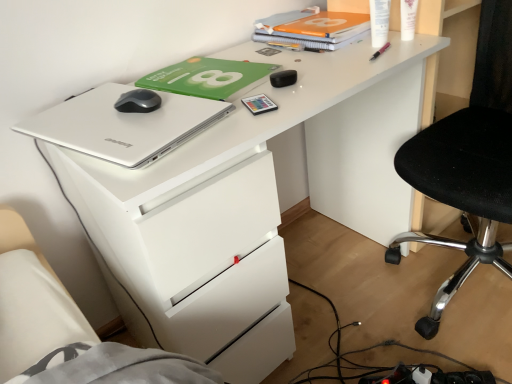
You are a GUI agent. You are given a task and a screenshot of the screen. Output one action in this format:
    pyautogui.click(x=<x>, y=<y>)
    Task: Click on the free space in front of matte plastic card at center, placed as the 5th stationery when sorted from right to left
    The height and width of the screenshot is (384, 512).
    Given the screenshot: What is the action you would take?
    pyautogui.click(x=238, y=132)